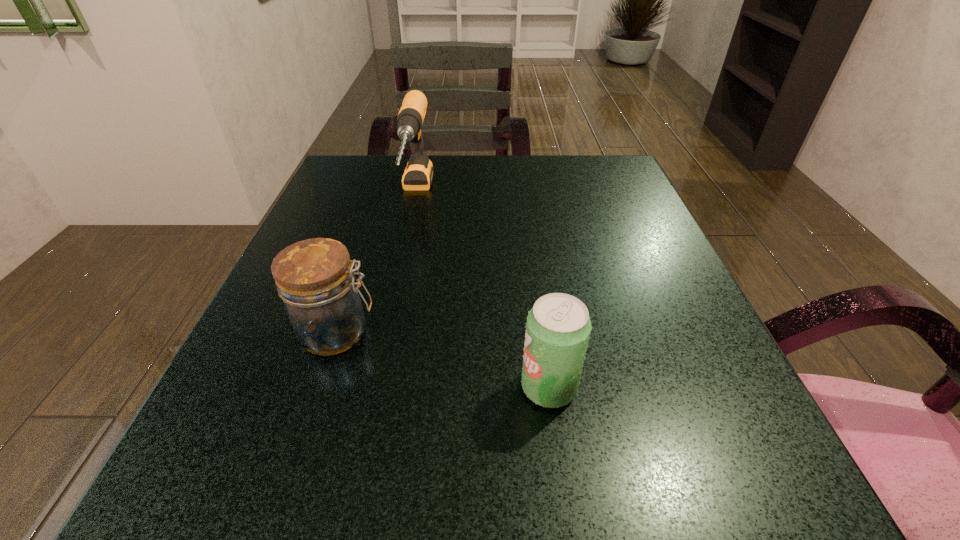
Identify the location of free region that satisfies the following two spatial constraints: 1. on the handle side of the farthest object; 2. on the lid of the second farthest object. The height and width of the screenshot is (540, 960). (387, 333).

Locate an element on the screen. vacant space that satisfies the following two spatial constraints: 1. on the handle side of the soda; 2. on the right side of the farthest object is located at coordinates (374, 387).

Identify the location of vacant area that satisfies the following two spatial constraints: 1. on the lid of the second nearest object; 2. on the right side of the rightmost object. The image size is (960, 540). (320, 387).

Locate an element on the screen. free space that satisfies the following two spatial constraints: 1. on the lid of the second nearest object; 2. on the back side of the nearest object is located at coordinates (320, 387).

The image size is (960, 540). Identify the location of free space in the image that satisfies the following two spatial constraints: 1. on the handle side of the rightmost object; 2. on the right side of the farthest object. (374, 387).

At what (x,y) coordinates should I click in order to perform the action: click on vacant space that satisfies the following two spatial constraints: 1. on the handle side of the tallest object; 2. on the right side of the rightmost object. Please return your answer as a coordinate pair (x, y). Image resolution: width=960 pixels, height=540 pixels. Looking at the image, I should click on (374, 387).

Find the location of a particular element. The height and width of the screenshot is (540, 960). free space that satisfies the following two spatial constraints: 1. on the handle side of the farthest object; 2. on the lid of the jar is located at coordinates (387, 333).

The width and height of the screenshot is (960, 540). Find the location of `vacant region that satisfies the following two spatial constraints: 1. on the handle side of the farthest object; 2. on the left side of the soda`. vacant region that satisfies the following two spatial constraints: 1. on the handle side of the farthest object; 2. on the left side of the soda is located at coordinates (374, 387).

In order to click on vacant region that satisfies the following two spatial constraints: 1. on the handle side of the tallest object; 2. on the lid of the second farthest object in this screenshot , I will do 387,333.

Locate an element on the screen. The width and height of the screenshot is (960, 540). vacant region that satisfies the following two spatial constraints: 1. on the lid of the jar; 2. on the right side of the soda is located at coordinates tap(320, 387).